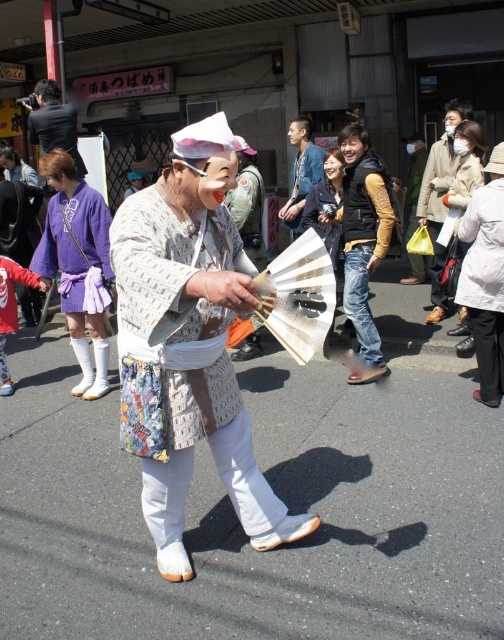
In the scene shown: You are standing at the point with coordinates point [334,173] and want to walk to the point with coordinates point [140,349]. Which direction should you move in?

You should move forward because point [140,349] is in front of point [334,173].

You are organizing a traditional Japanese performance and need to ensure that all performers have kimonos that fit properly. You have two kimonos available for selection. The first is the white cotton kimono at center, and the second is the purple fabric kimono at left. If a performer prefers a larger kimono, which one should they choose?

→ The white cotton kimono at center is bigger than the purple fabric kimono at left, so the performer should choose the white cotton kimono at center.